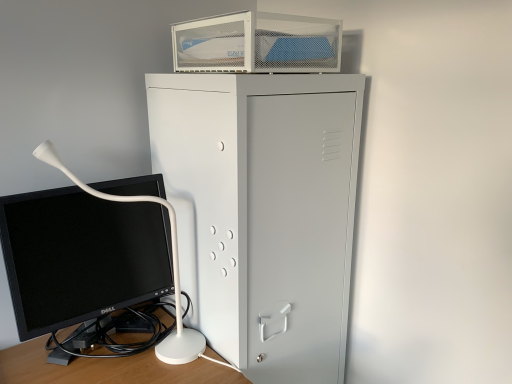
This screenshot has height=384, width=512. Describe the element at coordinates (81, 256) in the screenshot. I see `black glossy computer monitor at lower left` at that location.

Locate an element on the screen. This screenshot has height=384, width=512. metal mesh container at upper center is located at coordinates (257, 44).

Which point is more distant from viewer, (219, 330) or (180, 49)?

The point (180, 49) is farther.

Between metallic gray cabinet at center and metal mesh container at upper center, which one is positioned behind?

metal mesh container at upper center is more distant.

In the scene shown: Considering the sizes of metallic gray cabinet at center and metal mesh container at upper center in the image, is metallic gray cabinet at center bigger or smaller than metal mesh container at upper center?

Considering their sizes, metallic gray cabinet at center takes up more space than metal mesh container at upper center.

Which of these two, metallic gray cabinet at center or metal mesh container at upper center, stands taller?

Standing taller between the two is metallic gray cabinet at center.

Can you confirm if metal mesh container at upper center is shorter than black glossy computer monitor at lower left?

Yes.

Relative to black glossy computer monitor at lower left, is metal mesh container at upper center in front or behind?

Clearly, metal mesh container at upper center is behind black glossy computer monitor at lower left.

From a real-world perspective, which is physically above, metal mesh container at upper center or black glossy computer monitor at lower left?

metal mesh container at upper center, from a real-world perspective.

Is metal mesh container at upper center spatially inside metallic gray cabinet at center, or outside of it?

The correct answer is: outside.

From a real-world perspective, is metal mesh container at upper center physically below metallic gray cabinet at center?

No, from a real-world perspective, metal mesh container at upper center is not beneath metallic gray cabinet at center.

Between metal mesh container at upper center and metallic gray cabinet at center, which one has more height?

With more height is metallic gray cabinet at center.

From the image's perspective, is black glossy computer monitor at lower left on metal mesh container at upper center?

No.

Which of these two, black glossy computer monitor at lower left or metal mesh container at upper center, is thinner?

black glossy computer monitor at lower left is thinner.

Which is behind, point (293, 298) or point (133, 242)?

Positioned behind is point (133, 242).

In the scene shown: Which is more to the right, metallic gray cabinet at center or black glossy computer monitor at lower left?

metallic gray cabinet at center.

Is metallic gray cabinet at center inside the boundaries of black glossy computer monitor at lower left, or outside?

metallic gray cabinet at center is outside black glossy computer monitor at lower left.

Is metallic gray cabinet at center aimed at black glossy computer monitor at lower left?

No, metallic gray cabinet at center is not aimed at black glossy computer monitor at lower left.

Looking at this image, can you see black glossy computer monitor at lower left touching metallic gray cabinet at center?

No.

Does black glossy computer monitor at lower left have a greater height compared to metallic gray cabinet at center?

No, black glossy computer monitor at lower left is not taller than metallic gray cabinet at center.

Can you confirm if black glossy computer monitor at lower left is smaller than metallic gray cabinet at center?

Correct, black glossy computer monitor at lower left occupies less space than metallic gray cabinet at center.

Find the location of a particular element. Image resolution: width=512 pixels, height=384 pixels. computer monitor that appears on the left of metallic gray cabinet at center is located at coordinates coord(81,256).

Identify the location of desktop above the metallic gray cabinet at center (from the image's perspective). (257, 44).

Identify the location of desktop located above the black glossy computer monitor at lower left (from a real-world perspective). (257, 44).

Considering their positions, is metallic gray cabinet at center positioned closer to metal mesh container at upper center than black glossy computer monitor at lower left?

The object closer to metal mesh container at upper center is metallic gray cabinet at center.

When comparing their distances from black glossy computer monitor at lower left, does metal mesh container at upper center or metallic gray cabinet at center seem closer?

The object closer to black glossy computer monitor at lower left is metallic gray cabinet at center.

When comparing their distances from metallic gray cabinet at center, does black glossy computer monitor at lower left or metal mesh container at upper center seem further?

black glossy computer monitor at lower left lies further to metallic gray cabinet at center than the other object.

Based on their spatial positions, is metallic gray cabinet at center or metal mesh container at upper center further from black glossy computer monitor at lower left?

metal mesh container at upper center is further to black glossy computer monitor at lower left.

Estimate the real-world distances between objects in this image. Which object is further from metal mesh container at upper center, black glossy computer monitor at lower left or metallic gray cabinet at center?

black glossy computer monitor at lower left.

When comparing their distances from metallic gray cabinet at center, does metal mesh container at upper center or black glossy computer monitor at lower left seem further?

black glossy computer monitor at lower left is further to metallic gray cabinet at center.

Find the location of a particular element. Image resolution: width=512 pixels, height=384 pixels. computer monitor between metal mesh container at upper center and metallic gray cabinet at center in the vertical direction is located at coordinates (81, 256).